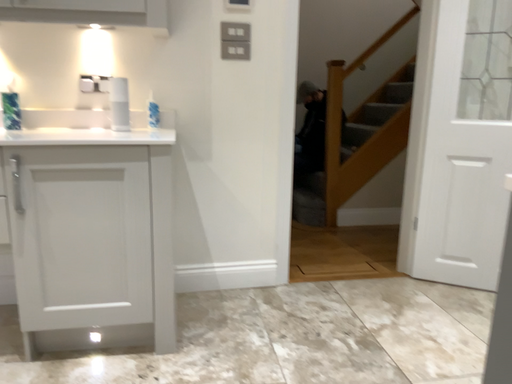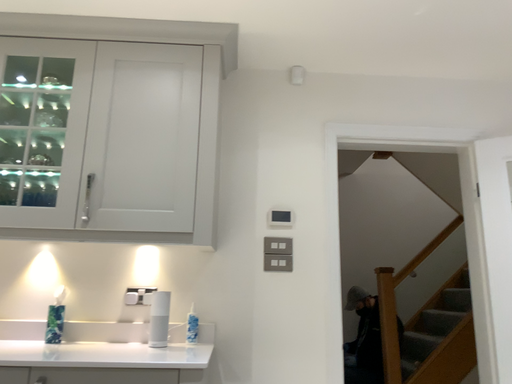
Question: How did the camera likely rotate when shooting the video?

Choices:
 (A) rotated left
 (B) rotated right

Answer: (A)